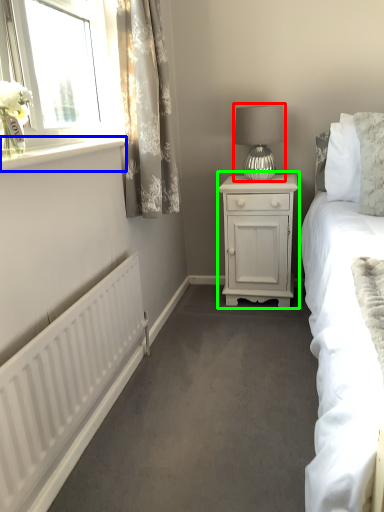
Question: Based on their relative distances, which object is farther from table lamp (highlighted by a red box)? Choose from window sill (highlighted by a blue box) and nightstand (highlighted by a green box).

Choices:
 (A) window sill
 (B) nightstand

Answer: (A)